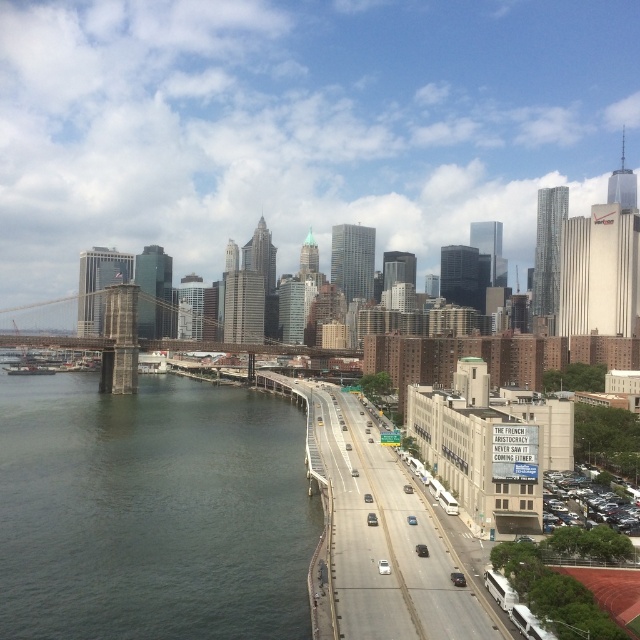
Question: Does gray concrete river at left appear over gray metallic bridge at center?

Choices:
 (A) no
 (B) yes

Answer: (A)

Question: Among these points, which one is farthest from the camera?

Choices:
 (A) (365, 589)
 (B) (196, 348)
 (C) (141, 618)

Answer: (B)

Question: In this image, where is gray concrete river at left located relative to concrete asphalt highway at center?

Choices:
 (A) left
 (B) right

Answer: (A)

Question: Among these points, which one is farthest from the camera?

Choices:
 (A) (22, 436)
 (B) (483, 600)

Answer: (A)

Question: Which is farther from the gray metallic bridge at center?

Choices:
 (A) gray concrete river at left
 (B) concrete asphalt highway at center

Answer: (B)

Question: Does gray concrete river at left come behind gray metallic bridge at center?

Choices:
 (A) no
 (B) yes

Answer: (A)